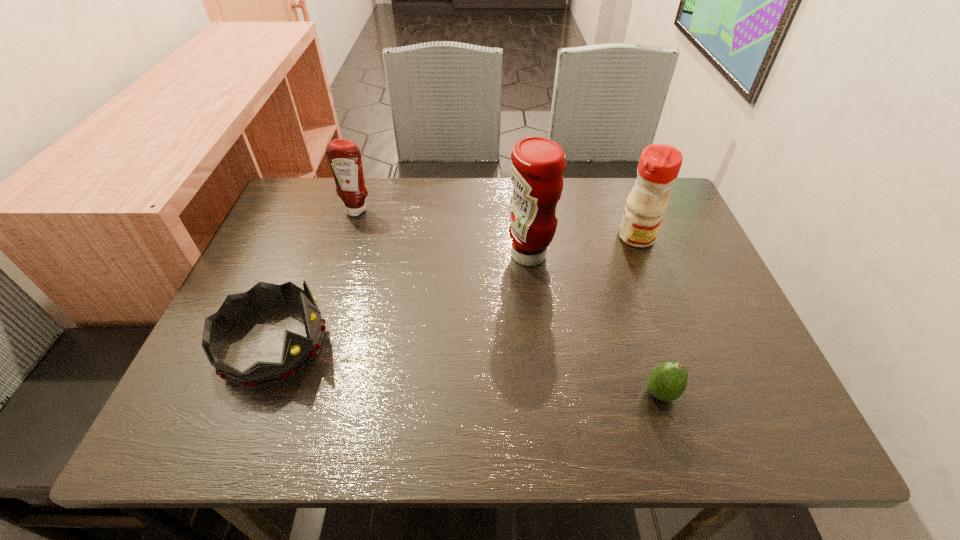
Image resolution: width=960 pixels, height=540 pixels. I want to click on vacant area that lies between the second condiment from right to left and the avocado, so point(594,324).

Locate an element on the screen. The image size is (960, 540). blank region between the farthest condiment and the shortest object is located at coordinates (509, 301).

Where is `object that is the third closest to the leftmost condiment`? object that is the third closest to the leftmost condiment is located at coordinates (659, 165).

Locate an element on the screen. the second closest object to the second tallest condiment is located at coordinates (667, 381).

Identify which condiment is the second closest to the fourth shortest object. Please provide its 2D coordinates. Your answer should be formatted as a tuple, i.e. [(x, y)], where the tuple contains the x and y coordinates of a point satisfying the conditions above.

[(344, 156)]

Point out which condiment is positioned as the nearest to the farthest object. Please provide its 2D coordinates. Your answer should be formatted as a tuple, i.e. [(x, y)], where the tuple contains the x and y coordinates of a point satisfying the conditions above.

[(538, 163)]

Identify the location of vacant space that satisfies the following two spatial constraints: 1. on the front side of the fourth shortest object; 2. at the front of the fourth tallest object with jewels. (677, 344).

The height and width of the screenshot is (540, 960). What are the coordinates of `vacant region that satisfies the following two spatial constraints: 1. on the front side of the shortest condiment; 2. on the right side of the avocado` in the screenshot? It's located at (300, 393).

What are the coordinates of `vacant region that satisfies the following two spatial constraints: 1. on the front side of the farthest object; 2. on the right side of the third object from right to left` in the screenshot? It's located at (344, 255).

Where is `free space that satisfies the following two spatial constraints: 1. on the front side of the avocado; 2. on the left side of the second condiment from left to right`? The height and width of the screenshot is (540, 960). free space that satisfies the following two spatial constraints: 1. on the front side of the avocado; 2. on the left side of the second condiment from left to right is located at coordinates (543, 393).